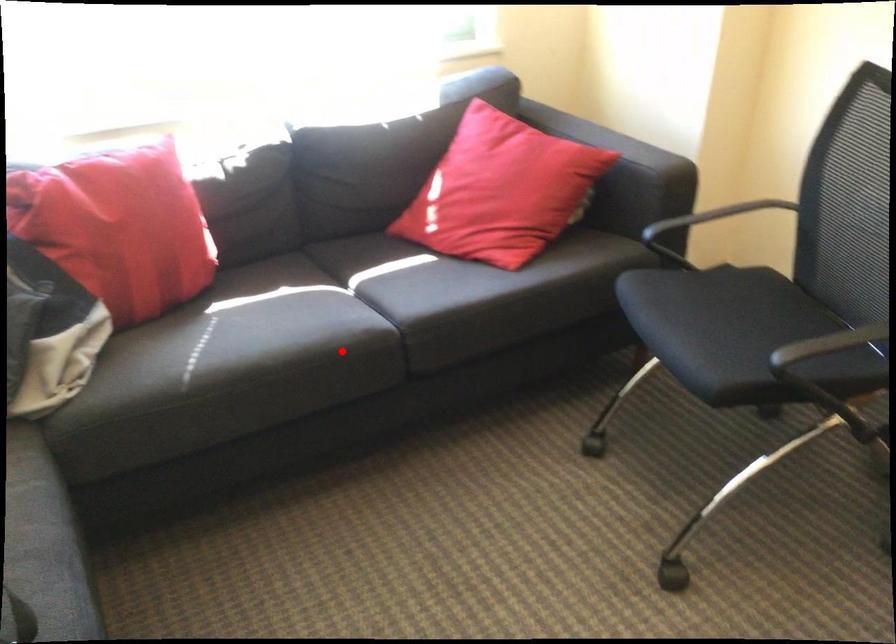
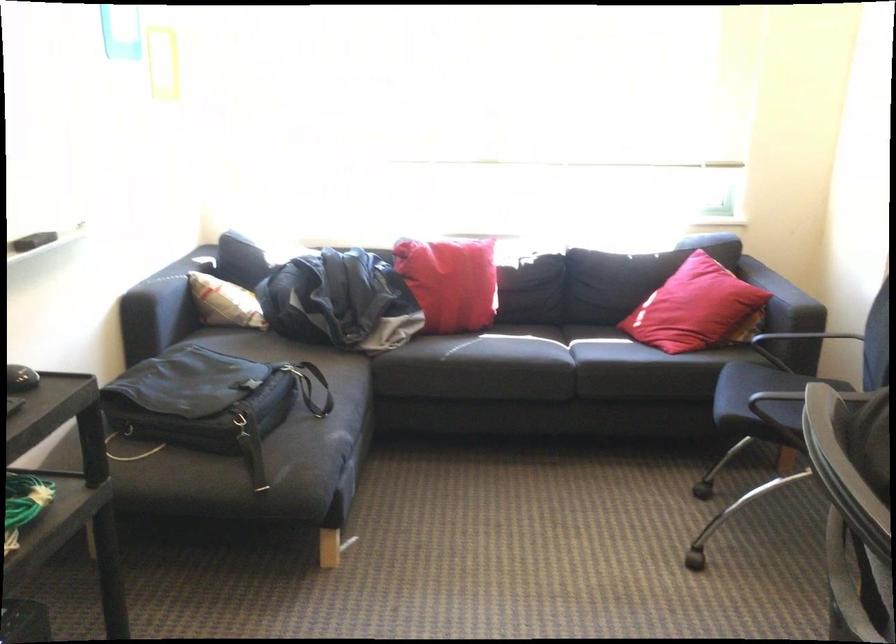
Question: I am providing you with two images of the same scene from different viewpoints. A red point is shown in image1. For the corresponding object point in image2, is it positioned nearer or farther from the camera?

Choices:
 (A) Nearer
 (B) Farther

Answer: (B)